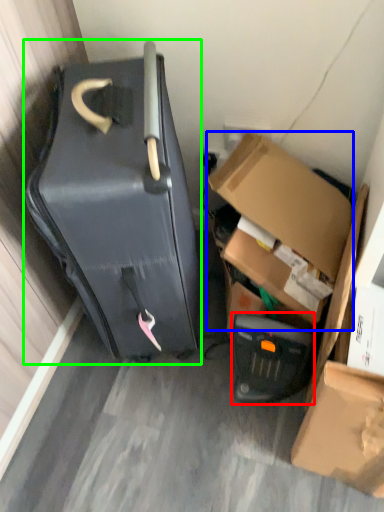
Question: Estimate the real-world distances between objects in this image. Which object is farther from appliance (highlighted by a red box), box (highlighted by a blue box) or suitcase (highlighted by a green box)?

Choices:
 (A) box
 (B) suitcase

Answer: (B)